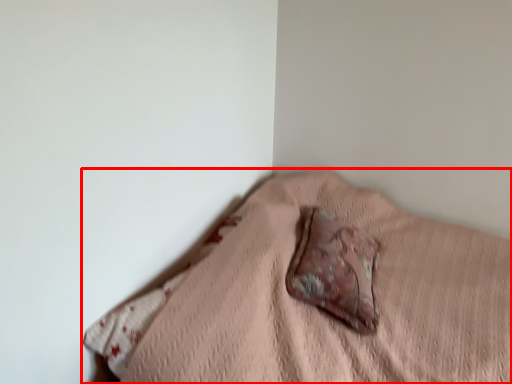
Question: From the image's perspective, what is the correct spatial relationship of furniture (annotated by the red box) in relation to throw pillow?

Choices:
 (A) below
 (B) above

Answer: (A)